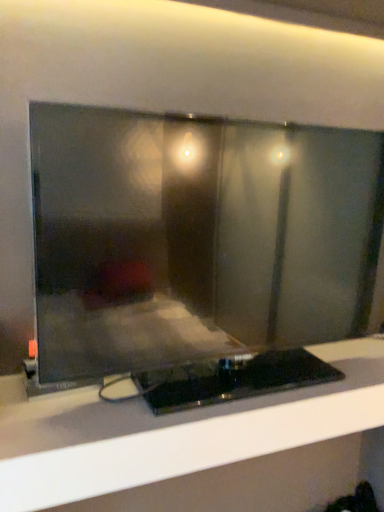
What do you see at coordinates (171, 432) in the screenshot?
I see `black glossy tv stand at center` at bounding box center [171, 432].

You are a GUI agent. You are given a task and a screenshot of the screen. Output one action in this format:
    pyautogui.click(x=<x>, y=<y>)
    Task: Click on the black glossy tv stand at center
    
    Given the screenshot: What is the action you would take?
    pyautogui.click(x=171, y=432)

What is the approximate height of matte black monitor at center?

matte black monitor at center is 57.21 centimeters tall.

Image resolution: width=384 pixels, height=512 pixels. What do you see at coordinates (196, 237) in the screenshot?
I see `matte black monitor at center` at bounding box center [196, 237].

Image resolution: width=384 pixels, height=512 pixels. What are the coordinates of `matte black monitor at center` in the screenshot? It's located at coord(196,237).

The image size is (384, 512). I want to click on black glossy tv stand at center, so click(171, 432).

Considering the positions of objects matte black monitor at center and black glossy tv stand at center in the image provided, who is more to the left, matte black monitor at center or black glossy tv stand at center?

matte black monitor at center.

Which object is closer to the camera taking this photo, matte black monitor at center or black glossy tv stand at center?

matte black monitor at center is in front.

Is point (165, 212) less distant than point (237, 431)?

That is False.

From the image's perspective, is matte black monitor at center over black glossy tv stand at center?

Yes, from the image's perspective, matte black monitor at center is over black glossy tv stand at center.

From a real-world perspective, who is located higher, matte black monitor at center or black glossy tv stand at center?

matte black monitor at center.

Is matte black monitor at center thinner than black glossy tv stand at center?

Correct, the width of matte black monitor at center is less than that of black glossy tv stand at center.

Considering the sizes of objects matte black monitor at center and black glossy tv stand at center in the image provided, who is shorter, matte black monitor at center or black glossy tv stand at center?

black glossy tv stand at center.

Who is smaller, matte black monitor at center or black glossy tv stand at center?

black glossy tv stand at center.

Is matte black monitor at center inside or outside of black glossy tv stand at center?

matte black monitor at center is not enclosed by black glossy tv stand at center.

Is there a large distance between matte black monitor at center and black glossy tv stand at center?

No, there isn't a large distance between matte black monitor at center and black glossy tv stand at center.

Is matte black monitor at center facing towards black glossy tv stand at center?

No.

How distant is matte black monitor at center from black glossy tv stand at center?

10.32 inches.

There is a black glossy tv stand at center. What are the coordinates of `computer monitor above it (from a real-world perspective)` in the screenshot? It's located at (196, 237).

Which is more to the left, black glossy tv stand at center or matte black monitor at center?

From the viewer's perspective, matte black monitor at center appears more on the left side.

Considering the positions of objects black glossy tv stand at center and matte black monitor at center in the image provided, who is in front, black glossy tv stand at center or matte black monitor at center?

matte black monitor at center is in front.

Is point (333, 395) in front of point (369, 212)?

Yes.

From the image's perspective, would you say black glossy tv stand at center is positioned over matte black monitor at center?

No, from the image's perspective, black glossy tv stand at center is not above matte black monitor at center.

Consider the image. From a real-world perspective, which is physically below, black glossy tv stand at center or matte black monitor at center?

black glossy tv stand at center is physically lower.

Which of these two, black glossy tv stand at center or matte black monitor at center, is wider?

black glossy tv stand at center.

Considering the sizes of objects black glossy tv stand at center and matte black monitor at center in the image provided, who is shorter, black glossy tv stand at center or matte black monitor at center?

black glossy tv stand at center.

Looking at the image, does black glossy tv stand at center seem bigger or smaller compared to matte black monitor at center?

black glossy tv stand at center is smaller than matte black monitor at center.

Looking at this image, is black glossy tv stand at center located outside matte black monitor at center?

black glossy tv stand at center lies outside matte black monitor at center's area.

Is black glossy tv stand at center touching matte black monitor at center?

No, black glossy tv stand at center is not next to matte black monitor at center.

Is black glossy tv stand at center oriented away from matte black monitor at center?

No, black glossy tv stand at center is not facing the opposite direction of matte black monitor at center.

Can you tell me how much black glossy tv stand at center and matte black monitor at center differ in facing direction?

black glossy tv stand at center and matte black monitor at center are facing 0.00144 degrees away from each other.

How far apart are black glossy tv stand at center and matte black monitor at center?

black glossy tv stand at center and matte black monitor at center are 10.32 inches apart from each other.

Locate an element on the screen. This screenshot has height=512, width=384. computer monitor above the black glossy tv stand at center (from a real-world perspective) is located at coordinates (196, 237).

Identify the location of computer monitor above the black glossy tv stand at center (from a real-world perspective). (196, 237).

You are a GUI agent. You are given a task and a screenshot of the screen. Output one action in this format:
    pyautogui.click(x=<x>, y=<y>)
    Task: Click on the furniture on the right of matte black monitor at center
    The width and height of the screenshot is (384, 512).
    Given the screenshot: What is the action you would take?
    pyautogui.click(x=171, y=432)